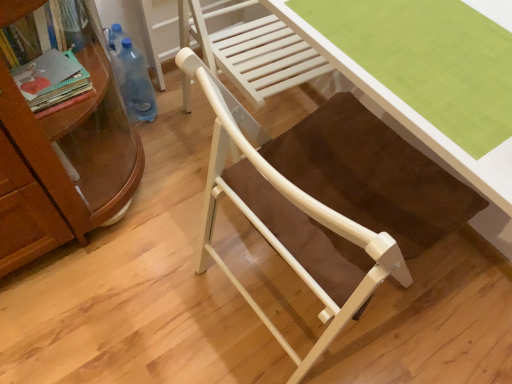
Locate an element on the screen. free region under matte white chair at center (from a real-world perspective) is located at coordinates (277, 292).